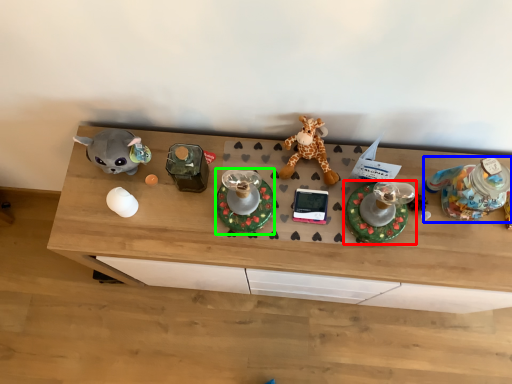
Question: Which is farther away from toy (highlighted by a red box)? toy (highlighted by a blue box) or toy (highlighted by a green box)?

Choices:
 (A) toy
 (B) toy

Answer: (B)